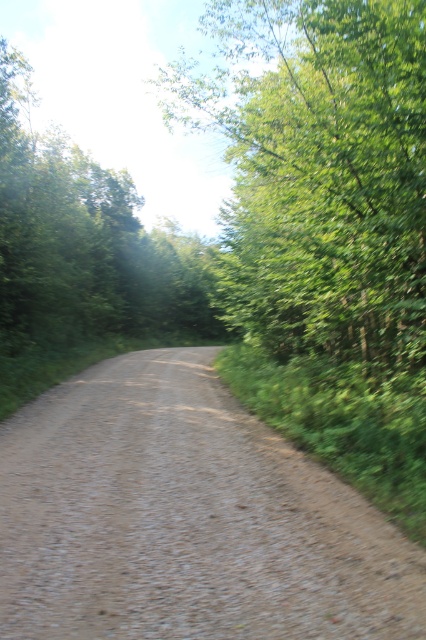
You are standing on the dirt road in the forest and see two points marked on the road. The first point is at coordinates point (294, 500) and the second is at point (351, 188). Which point is nearer to you?

Point (294, 500) is closer to the viewer than point (351, 188).

You are standing at the starting point of the dirt road in the forest. You see the point marked as point (186,518). Is this point on the dirt road?

Yes, the dirt road at center is represented by point (186,518), so the point is on the dirt road.